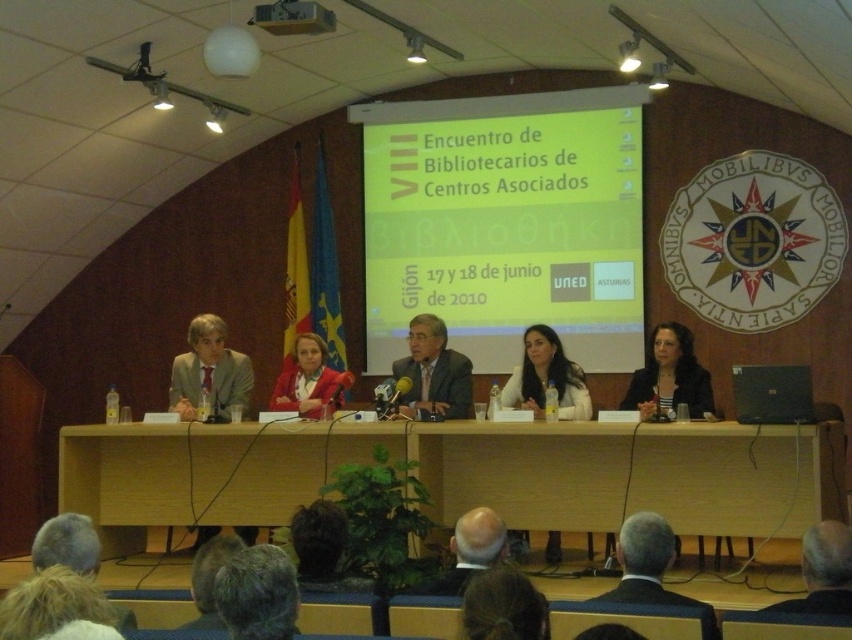
Question: Which point is closer to the camera taking this photo?

Choices:
 (A) (419, 468)
 (B) (801, 422)
 (C) (325, 392)

Answer: (B)

Question: Can you confirm if dark gray suit at lower center is positioned to the left of gray hair at lower right?

Choices:
 (A) yes
 (B) no

Answer: (A)

Question: Where is green matte projection screen at center located in relation to gray hair at center in the image?

Choices:
 (A) left
 (B) right

Answer: (B)

Question: Which object is closer to the camera taking this photo?

Choices:
 (A) dark gray suit at lower center
 (B) matte gray suit at center
 (C) wooden table at center

Answer: (A)

Question: Which is farther from the bald head at center?

Choices:
 (A) dark gray suit at lower center
 (B) gray hair at center
 (C) matte red blazer at center

Answer: (C)

Question: Does dark brown leather jacket at center appear on the right side of black plastic laptop at center?

Choices:
 (A) no
 (B) yes

Answer: (A)